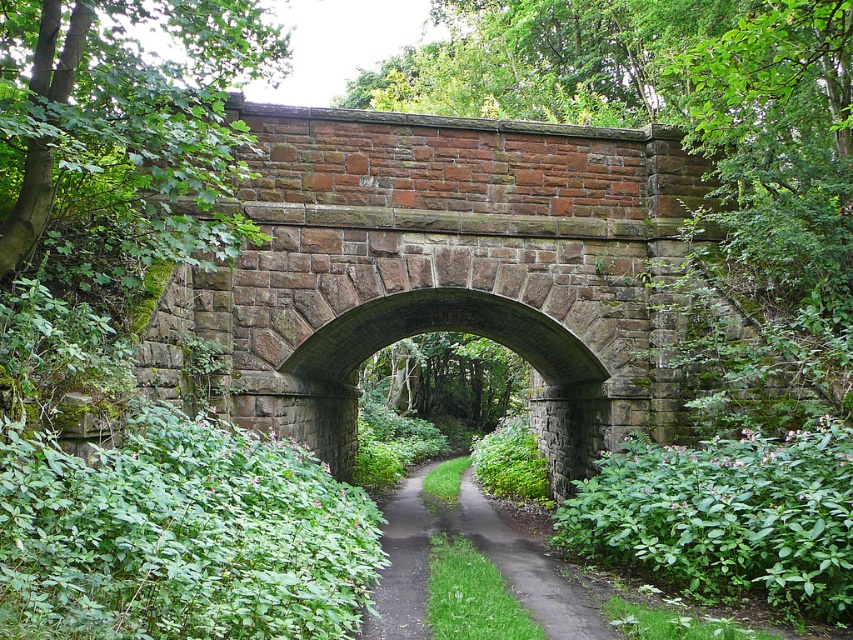
Question: Which of the following is the closest to the observer?

Choices:
 (A) green leafy bush at center
 (B) dirt path at center

Answer: (A)

Question: Does green leafy bush at lower left appear under dirt path at center?

Choices:
 (A) yes
 (B) no

Answer: (B)

Question: Which point is farther from the camera taking this photo?

Choices:
 (A) (680, 500)
 (B) (410, 588)
 (C) (254, 460)

Answer: (A)

Question: Can you confirm if green leafy bush at lower left is thinner than dirt path at center?

Choices:
 (A) no
 (B) yes

Answer: (A)

Question: Is reddish-brown stone archway at center further to the viewer compared to green leafy bush at center?

Choices:
 (A) yes
 (B) no

Answer: (A)

Question: Among these points, which one is farthest from the camera?

Choices:
 (A) (434, 518)
 (B) (589, 392)

Answer: (A)